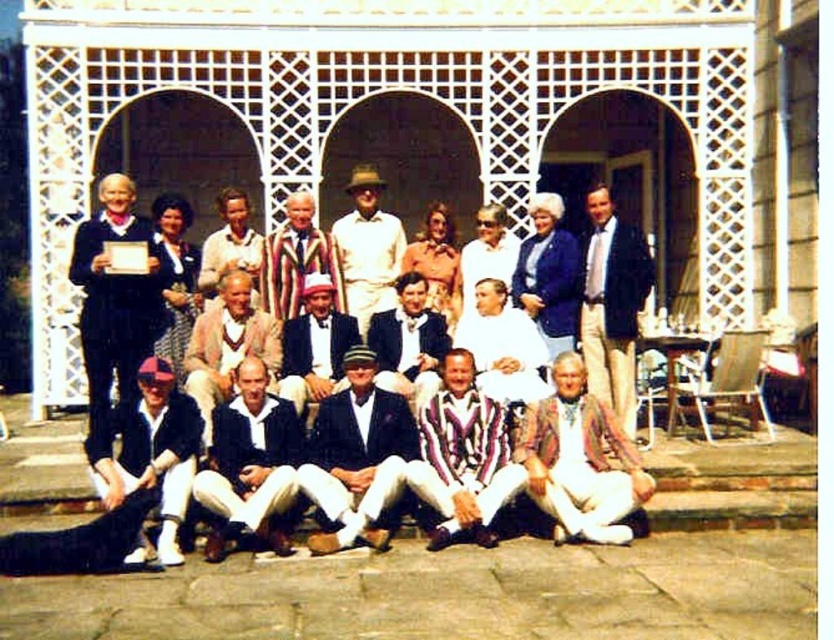
Question: Does dark blue jersey at center have a greater width compared to light pink fabric suit at center?

Choices:
 (A) yes
 (B) no

Answer: (B)

Question: Can you confirm if dark blue jersey at center is positioned to the right of striped wool suit at center?

Choices:
 (A) no
 (B) yes

Answer: (B)

Question: Which object is closer to the camera taking this photo?

Choices:
 (A) light pink fabric suit at center
 (B) striped fabric suit at center
 (C) white striped suit at center

Answer: (A)

Question: Which point is closer to the camera taking this photo?

Choices:
 (A) (548, 230)
 (B) (627, 310)

Answer: (B)

Question: Among these points, which one is nearest to the camera?

Choices:
 (A) (367, 244)
 (B) (599, 422)
 (C) (129, 424)

Answer: (C)

Question: Does light brown cotton pants at center have a larger size compared to white cotton shirt at center?

Choices:
 (A) no
 (B) yes

Answer: (A)